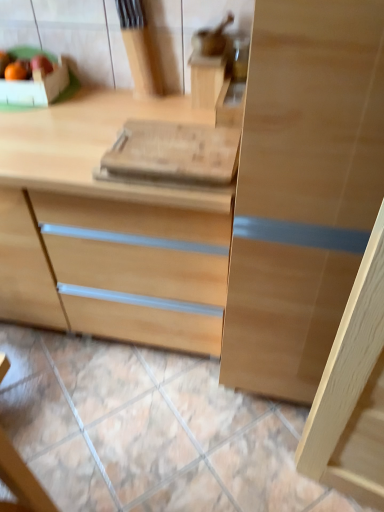
Where is `vacant space situated above natural stone tile at lower center (from a real-world perspective)`? Image resolution: width=384 pixels, height=512 pixels. vacant space situated above natural stone tile at lower center (from a real-world perspective) is located at coordinates (149, 412).